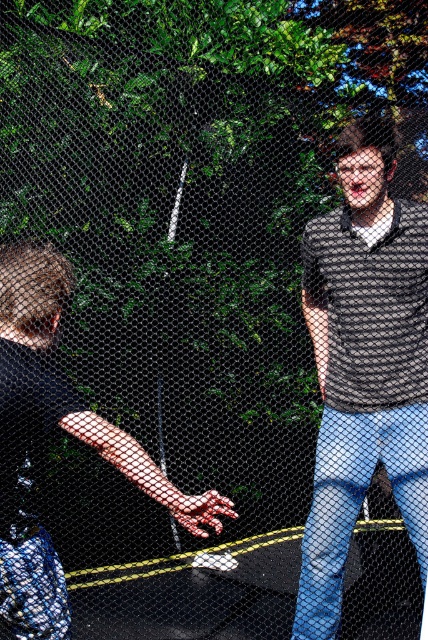
You are a photographer trying to capture both individuals in the scene. Since the fence is in the way, you need to adjust your position. Considering the spatial arrangement of the matte black shirt at right and black matte shirt at left, which direction should you move to ensure both are visible without the fence blocking them?

The matte black shirt at right is located above the black matte shirt at left, so moving upwards might allow you to capture both individuals without the fence blocking them.

You are a photographer trying to capture both individuals in a single shot. Given that the matte black shirt at right and the black matte shirt at left are partially obscured by the fence, which person should you focus on to ensure the subject with the larger size remains clearer in the photo?

The matte black shirt at right is bigger than the black matte shirt at left, so focusing on the matte black shirt at right would ensure the larger subject remains clearer in the photo.